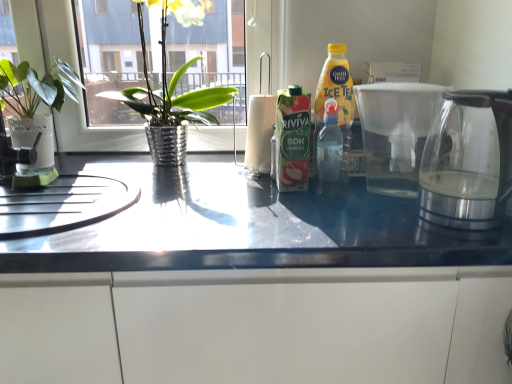
Question: Should I look upward or downward to see metallic silver pot at left, which appears as the 1th houseplant when viewed from the right?

Choices:
 (A) up
 (B) down

Answer: (A)

Question: Can you confirm if green cardboard carton at center is positioned to the left of metallic silver pot at left, which appears as the 1th houseplant when viewed from the right?

Choices:
 (A) yes
 (B) no

Answer: (B)

Question: Can you confirm if green cardboard carton at center is wider than metallic silver pot at left, which appears as the 1th houseplant when viewed from the right?

Choices:
 (A) yes
 (B) no

Answer: (B)

Question: Is green cardboard carton at center positioned beyond the bounds of metallic silver pot at left, which appears as the 1th houseplant when viewed from the right?

Choices:
 (A) yes
 (B) no

Answer: (A)

Question: Is green cardboard carton at center smaller than metallic silver pot at left, which ranks as the second houseplant in left-to-right order?

Choices:
 (A) no
 (B) yes

Answer: (B)

Question: Considering the relative positions of green cardboard carton at center and metallic silver pot at left, which appears as the 1th houseplant when viewed from the right, in the image provided, is green cardboard carton at center in front of metallic silver pot at left, which appears as the 1th houseplant when viewed from the right,?

Choices:
 (A) yes
 (B) no

Answer: (A)

Question: Considering the relative sizes of green cardboard carton at center and metallic silver pot at left, which ranks as the second houseplant in left-to-right order, in the image provided, is green cardboard carton at center bigger than metallic silver pot at left, which ranks as the second houseplant in left-to-right order,?

Choices:
 (A) no
 (B) yes

Answer: (A)

Question: Does transparent glass kettle at right, the first coffeepot positioned from the front, turn towards glossy white cabinet at lower center?

Choices:
 (A) no
 (B) yes

Answer: (A)

Question: Is transparent glass kettle at right, which is counted as the 2th coffeepot, starting from the back, beside glossy white cabinet at lower center?

Choices:
 (A) no
 (B) yes

Answer: (A)

Question: Is transparent glass kettle at right, the first coffeepot positioned from the front, turned away from glossy white cabinet at lower center?

Choices:
 (A) yes
 (B) no

Answer: (B)

Question: Can you confirm if transparent glass kettle at right, the first coffeepot positioned from the front, is thinner than glossy white cabinet at lower center?

Choices:
 (A) yes
 (B) no

Answer: (A)

Question: Can you confirm if transparent glass kettle at right, which is counted as the 2th coffeepot, starting from the back, is positioned to the right of glossy white cabinet at lower center?

Choices:
 (A) no
 (B) yes

Answer: (B)

Question: From a real-world perspective, is transparent glass kettle at right, which is counted as the 2th coffeepot, starting from the back, positioned over glossy white cabinet at lower center based on gravity?

Choices:
 (A) yes
 (B) no

Answer: (A)

Question: From a real-world perspective, is glossy white cabinet at lower center physically below transparent glass kettle at right, which is counted as the 2th coffeepot, starting from the back?

Choices:
 (A) yes
 (B) no

Answer: (A)